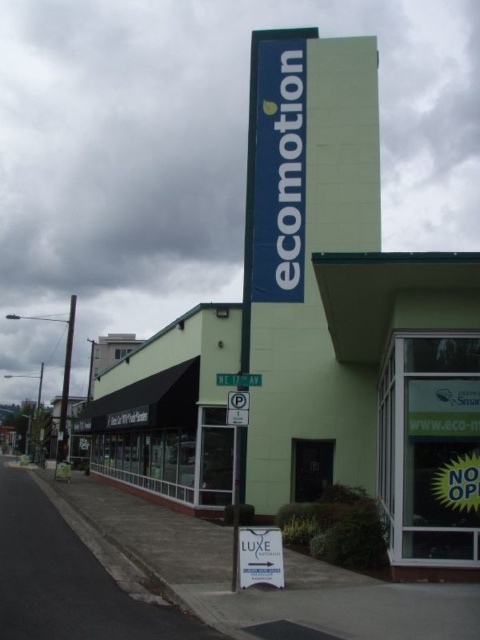
Question: Estimate the real-world distances between objects in this image. Which object is farther from the green matte sign at upper center?

Choices:
 (A) white paper parking sign at lower center
 (B) white paper sign at center

Answer: (A)

Question: Which of the following is the closest to the observer?

Choices:
 (A) (272, 572)
 (B) (244, 419)

Answer: (A)

Question: Does white paper sign at center appear over white paper parking sign at lower center?

Choices:
 (A) no
 (B) yes

Answer: (A)

Question: Is green matte sign at upper center closer to the viewer compared to white paper sign at center?

Choices:
 (A) yes
 (B) no

Answer: (B)

Question: Which object is the farthest from the white paper sign at center?

Choices:
 (A) green matte sign at upper center
 (B) white paper parking sign at lower center

Answer: (A)

Question: Does white paper sign at center have a smaller size compared to white paper parking sign at lower center?

Choices:
 (A) yes
 (B) no

Answer: (B)